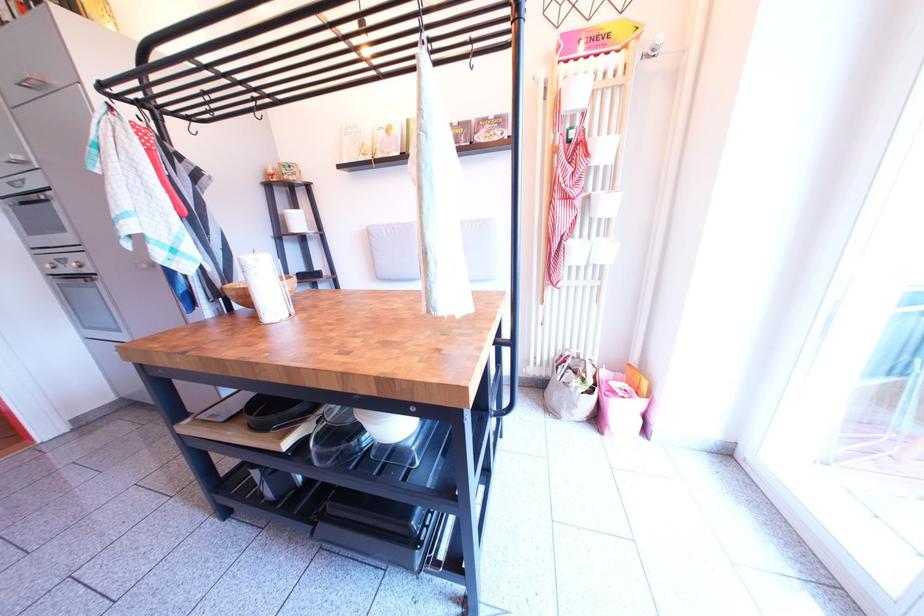
Identify the location of glass bowl. The height and width of the screenshot is (616, 924). (337, 415).